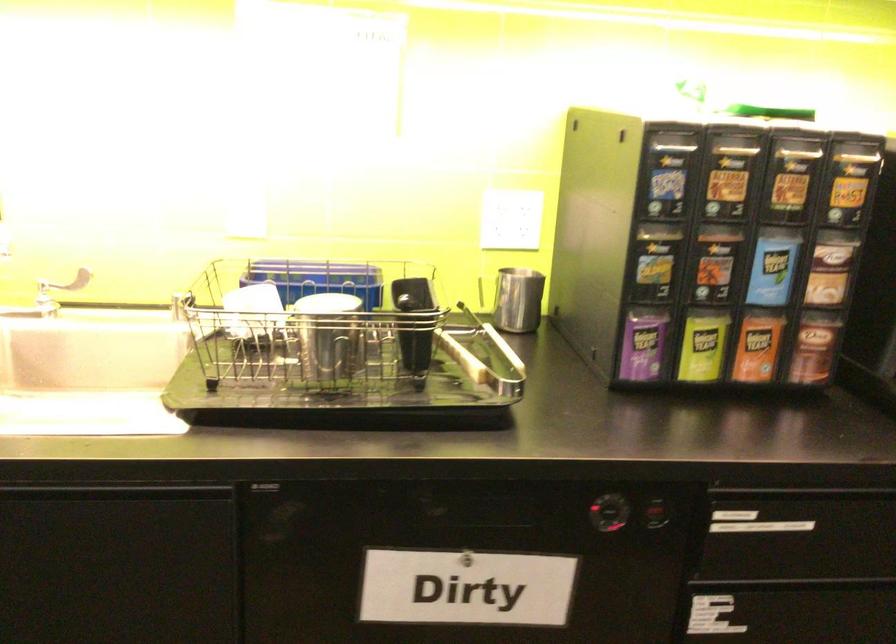
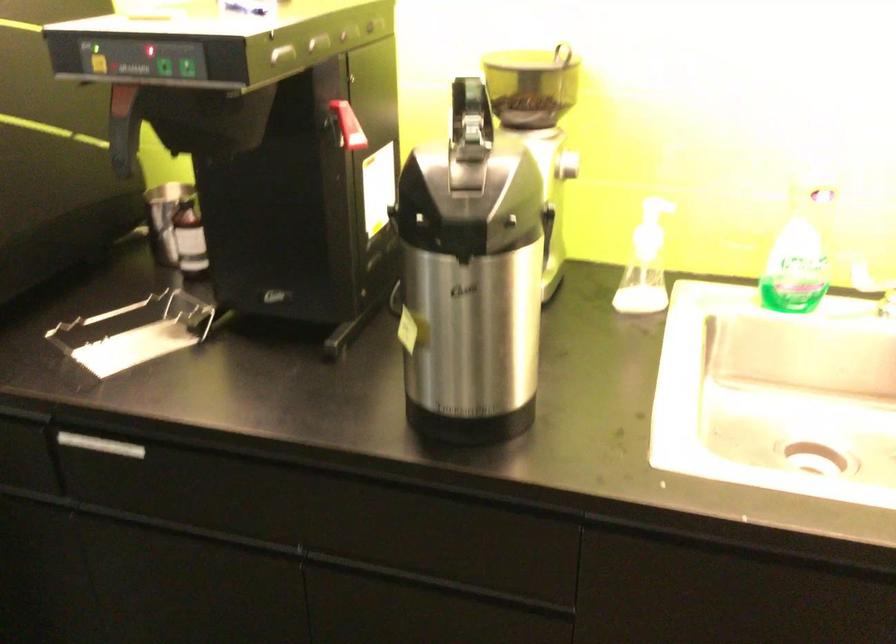
Question: What movement of the cameraman would produce the second image?

Choices:
 (A) Left
 (B) Right
 (C) Forward
 (D) Backward

Answer: (A)